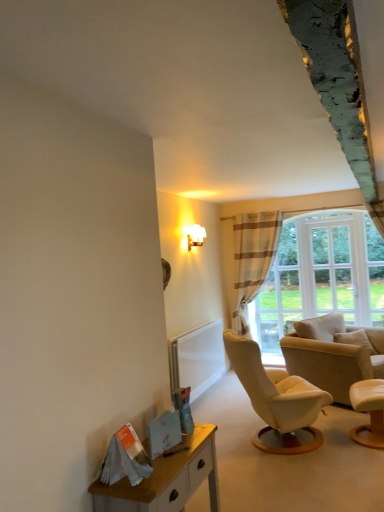
The height and width of the screenshot is (512, 384). In order to click on vacant space to the left of smooth beige armchair at lower right, placed as the 2th chair when sorted from back to front in this screenshot , I will do `click(336, 444)`.